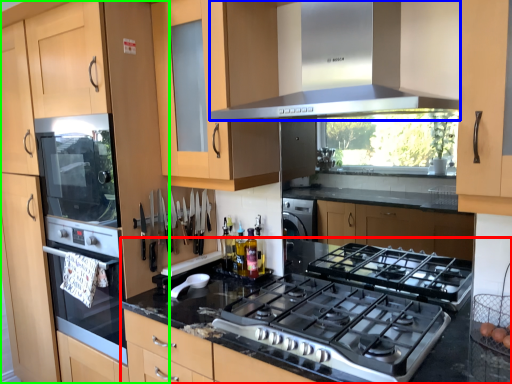
Question: Estimate the real-world distances between objects in this image. Which object is closer to countertop (highlighted by a red box), home appliance (highlighted by a blue box) or cabinetry (highlighted by a green box)?

Choices:
 (A) home appliance
 (B) cabinetry

Answer: (A)